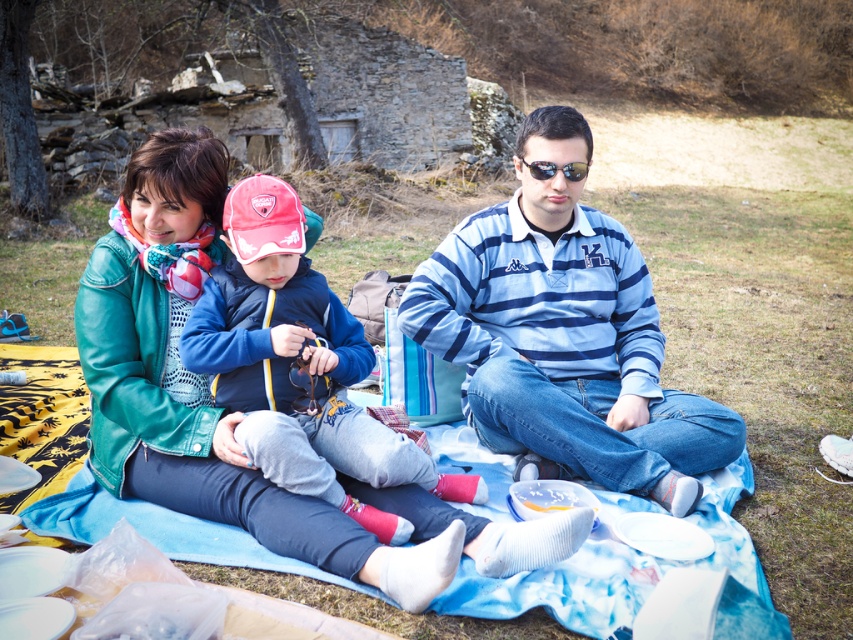
Is blue striped polo shirt at center to the left of blue striped jersey at center from the viewer's perspective?

Indeed, blue striped polo shirt at center is positioned on the left side of blue striped jersey at center.

Image resolution: width=853 pixels, height=640 pixels. What do you see at coordinates (564, 333) in the screenshot? I see `blue striped polo shirt at center` at bounding box center [564, 333].

Identify the location of blue striped polo shirt at center. The image size is (853, 640). (564, 333).

Is blue striped polo shirt at center wider than blue fleece jacket at center?

Indeed, blue striped polo shirt at center has a greater width compared to blue fleece jacket at center.

Does blue striped polo shirt at center appear under blue fleece jacket at center?

No, blue striped polo shirt at center is not below blue fleece jacket at center.

Identify the location of blue striped polo shirt at center. (564, 333).

Find the location of a particular element. blue striped polo shirt at center is located at coordinates (564, 333).

Does blue striped jersey at center have a lesser height compared to blue fleece jacket at center?

No.

Measure the distance between point (672, 413) and camera.

Point (672, 413) and camera are 3.16 meters apart from each other.

You are a GUI agent. You are given a task and a screenshot of the screen. Output one action in this format:
    pyautogui.click(x=<x>, y=<y>)
    Task: Click on the blue striped jersey at center
    This screenshot has height=640, width=853.
    Given the screenshot: What is the action you would take?
    [x=564, y=333]